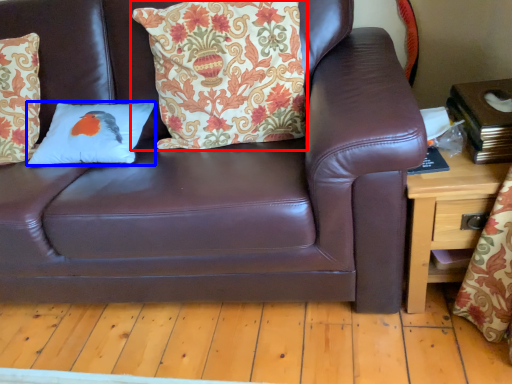
Question: Which of the following is the closest to the observer, pillow (highlighted by a red box) or pillow (highlighted by a blue box)?

Choices:
 (A) pillow
 (B) pillow

Answer: (A)